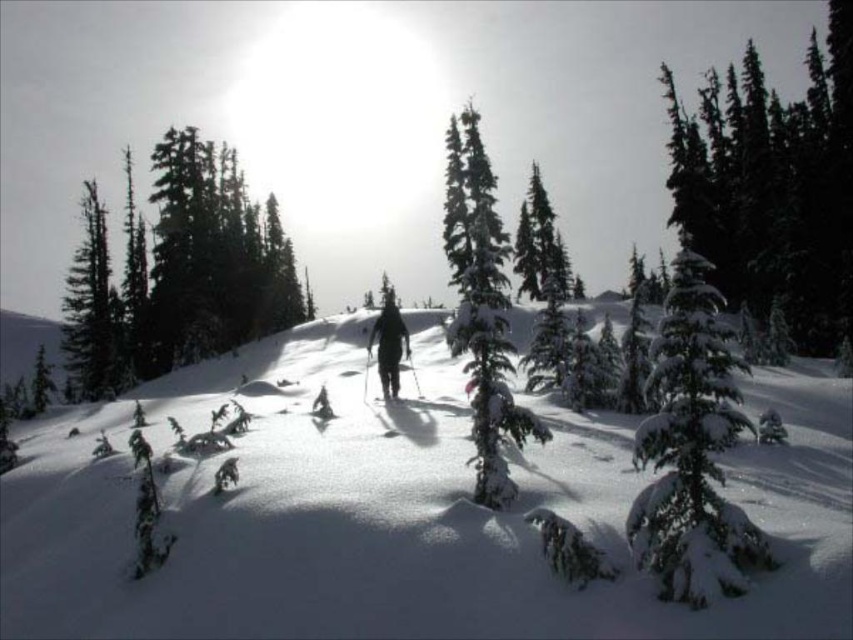
Is green matte tree at upper right to the left of snow-covered evergreen at center from the viewer's perspective?

In fact, green matte tree at upper right is to the right of snow-covered evergreen at center.

Measure the distance between point (726, 196) and camera.

The distance of point (726, 196) from camera is 68.31 meters.

Is point (833, 157) positioned after point (506, 323)?

Yes, it is behind point (506, 323).

You are a GUI agent. You are given a task and a screenshot of the screen. Output one action in this format:
    pyautogui.click(x=<x>, y=<y>)
    Task: Click on the green matte tree at upper right
    
    Given the screenshot: What is the action you would take?
    pyautogui.click(x=773, y=188)

Does snow-covered evergreen at center-right have a lesser height compared to green matte tree at left?

Yes.

The height and width of the screenshot is (640, 853). Identify the location of snow-covered evergreen at center-right. (692, 451).

Is point (668, 573) farther from camera compared to point (94, 332)?

No, it is in front of (94, 332).

Where is `snow-covered evergreen at center-right`? snow-covered evergreen at center-right is located at coordinates (692, 451).

Which is above, green matte tree at left or green textured pine tree at center?

green textured pine tree at center is above.

Does point (70, 388) come in front of point (546, 307)?

No.

Is point (99, 288) more distant than point (515, 260)?

No, (99, 288) is closer to viewer.

Identify the location of green matte tree at left. (91, 310).